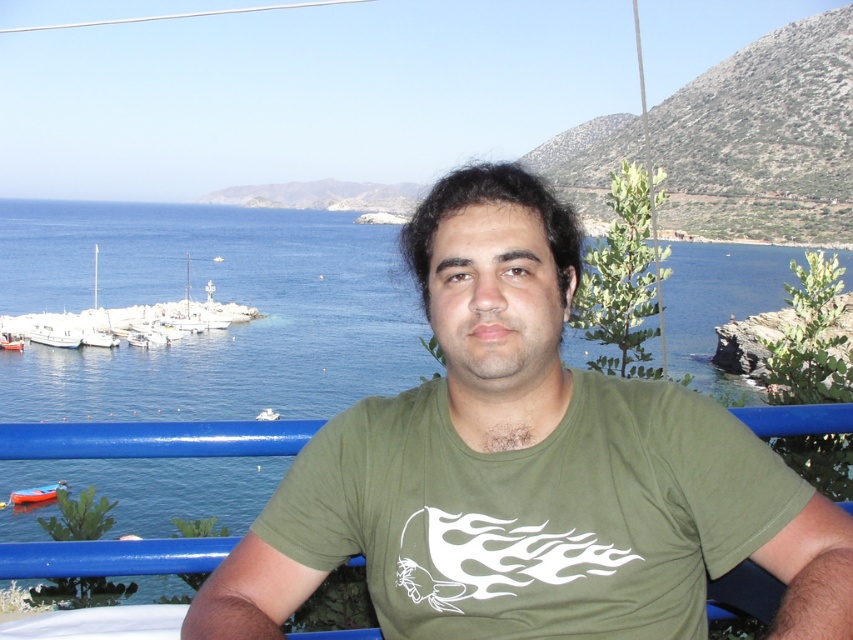
Looking at this image, who is positioned more to the left, green matte t-shirt at center or orange fiberglass boat at lower left?

orange fiberglass boat at lower left

What do you see at coordinates (527, 470) in the screenshot?
I see `green matte t-shirt at center` at bounding box center [527, 470].

The image size is (853, 640). Describe the element at coordinates (527, 470) in the screenshot. I see `green matte t-shirt at center` at that location.

Find the location of a particular element. The image size is (853, 640). green matte t-shirt at center is located at coordinates (527, 470).

Locate an element on the screen. Image resolution: width=853 pixels, height=640 pixels. white matte boats at left is located at coordinates (123, 321).

Which is more to the right, white matte boats at left or orange fiberglass boat at lower left?

orange fiberglass boat at lower left is more to the right.

Between point (0, 326) and point (53, 486), which one is positioned in front?

Positioned in front is point (53, 486).

Identify the location of white matte boats at left. The width and height of the screenshot is (853, 640). (123, 321).

Does green matte t-shirt at center have a lesser height compared to white matte boats at left?

Correct, green matte t-shirt at center is not as tall as white matte boats at left.

Consider the image. Is green matte t-shirt at center taller than white matte boats at left?

In fact, green matte t-shirt at center may be shorter than white matte boats at left.

Locate an element on the screen. green matte t-shirt at center is located at coordinates (527, 470).